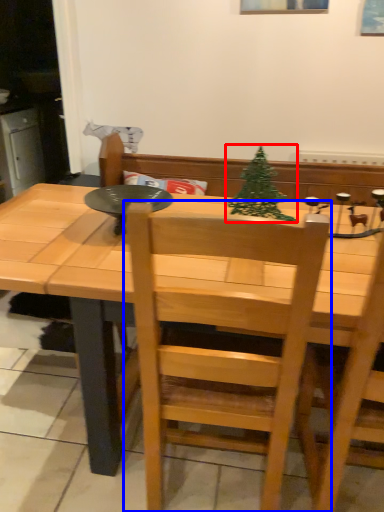
Question: Which point is closer to the camera, christmas tree (highlighted by a red box) or chair (highlighted by a blue box)?

Choices:
 (A) christmas tree
 (B) chair

Answer: (B)